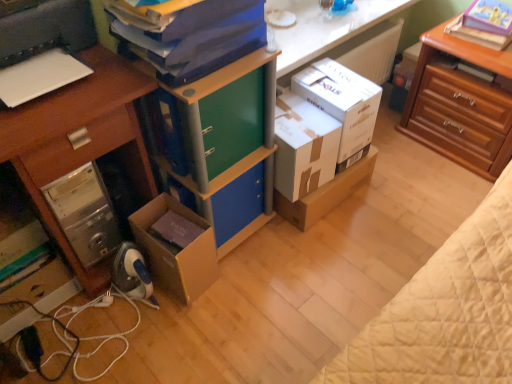
At what (x,y) coordinates should I click in order to perform the action: click on cardboard box at lower left, acting as the 1th box starting from the left. Please return your answer as a coordinate pair (x, y). Looking at the image, I should click on (179, 252).

Locate an element on the screen. The image size is (512, 384). white cardboard box at center, the 2th box from the left is located at coordinates (303, 146).

Image resolution: width=512 pixels, height=384 pixels. What do you see at coordinates (326, 194) in the screenshot?
I see `white cardboard box at center` at bounding box center [326, 194].

Measure the distance between blue matte folder at upper center and camera.

blue matte folder at upper center is 3.35 feet from camera.

Image resolution: width=512 pixels, height=384 pixels. I want to click on cardboard box at lower left, acting as the 1th box starting from the left, so click(x=179, y=252).

From a real-world perspective, which is physically below, white cardboard box at center or white plastic printer at left?

white cardboard box at center, from a real-world perspective.

Is point (366, 166) farther from viewer compared to point (54, 77)?

Yes, point (366, 166) is behind point (54, 77).

Would you say white cardboard box at center is inside or outside white plastic printer at left?

white cardboard box at center exists outside the volume of white plastic printer at left.

Based on the photo, is white cardboard box at center, the 2th box from the left, in front of or behind blue matte folder at upper center in the image?

white cardboard box at center, the 2th box from the left, is positioned farther from the viewer than blue matte folder at upper center.

From the picture: From a real-world perspective, is white cardboard box at center, the 2th box from the left, physically below blue matte folder at upper center?

Correct, in the physical world, white cardboard box at center, the 2th box from the left, is lower than blue matte folder at upper center.

Which object is positioned more to the right, white cardboard box at center, placed as the second box when sorted from right to left, or blue matte folder at upper center?

Positioned to the right is white cardboard box at center, placed as the second box when sorted from right to left.

Is white cardboard box at center, the 2th box from the left, shorter than blue matte folder at upper center?

No, white cardboard box at center, the 2th box from the left, is not shorter than blue matte folder at upper center.

Is blue matte folder at upper center inside the boundaries of white cardboard box at center, positioned as the first box in right-to-left order, or outside?

blue matte folder at upper center is not inside white cardboard box at center, positioned as the first box in right-to-left order, it's outside.

Is the position of blue matte folder at upper center more distant than that of white cardboard box at center, which is counted as the third box, starting from the left?

No, it is not.

From a real-world perspective, is blue matte folder at upper center physically above white cardboard box at center, positioned as the first box in right-to-left order?

Correct, in the physical world, blue matte folder at upper center is higher than white cardboard box at center, positioned as the first box in right-to-left order.

The width and height of the screenshot is (512, 384). Find the location of `book in front of the white cardboard box at center, positioned as the first box in right-to-left order`. book in front of the white cardboard box at center, positioned as the first box in right-to-left order is located at coordinates (200, 39).

Considering the relative positions of wooden nightstand at upper right and blue matte folder at upper center in the image provided, is wooden nightstand at upper right to the right of blue matte folder at upper center from the viewer's perspective?

Yes, wooden nightstand at upper right is to the right of blue matte folder at upper center.

Find the location of a particular element. The height and width of the screenshot is (384, 512). nightstand lying on the right of blue matte folder at upper center is located at coordinates (461, 106).

Considering the sizes of objects wooden nightstand at upper right and blue matte folder at upper center in the image provided, who is thinner, wooden nightstand at upper right or blue matte folder at upper center?

With smaller width is blue matte folder at upper center.

From a real-world perspective, is wooden nightstand at upper right physically located above or below blue matte folder at upper center?

wooden nightstand at upper right is below blue matte folder at upper center.

How different are the orientations of white cardboard box at center, positioned as the first box in right-to-left order, and wooden desk at left in degrees?

The facing directions of white cardboard box at center, positioned as the first box in right-to-left order, and wooden desk at left are 5.07 degrees apart.

From a real-world perspective, is white cardboard box at center, which is counted as the third box, starting from the left, positioned over wooden desk at left based on gravity?

No, from a real-world perspective, white cardboard box at center, which is counted as the third box, starting from the left, is not on top of wooden desk at left.

Who is shorter, white cardboard box at center, which is counted as the third box, starting from the left, or wooden desk at left?

Standing shorter between the two is white cardboard box at center, which is counted as the third box, starting from the left.

Which is more to the right, white cardboard box at center, which is counted as the third box, starting from the left, or wooden desk at left?

Result: Positioned to the right is white cardboard box at center, which is counted as the third box, starting from the left.

In the image, there is a blue matte bookshelf at center. At what (x,y) coordinates should I click in order to perform the action: click on printer above it (from the image's perspective). Please return your answer as a coordinate pair (x, y). Looking at the image, I should click on (42, 49).

Measure the distance between blue matte bookshelf at center and white plastic printer at left.

blue matte bookshelf at center is 16.36 inches from white plastic printer at left.

Between blue matte bookshelf at center and white plastic printer at left, which one has larger width?

white plastic printer at left.

Can you confirm if blue matte bookshelf at center is smaller than white plastic printer at left?

Actually, blue matte bookshelf at center might be larger than white plastic printer at left.

Between wooden desk at left and cardboard box at lower left, acting as the 1th box starting from the left, which one is positioned in front?

wooden desk at left is closer to the camera.

How many degrees apart are the facing directions of wooden desk at left and cardboard box at lower left, acting as the 1th box starting from the left?

wooden desk at left and cardboard box at lower left, acting as the 1th box starting from the left, are facing 1.84 degrees away from each other.

Starting from the wooden desk at left, which box is the 1st one behind? Please provide its 2D coordinates.

[(179, 252)]

How distant is wooden desk at left from cardboard box at lower left, acting as the 3th box starting from the right?

wooden desk at left and cardboard box at lower left, acting as the 3th box starting from the right, are 12.19 inches apart.

Locate an element on the screen. printer above the white cardboard box at center (from a real-world perspective) is located at coordinates (42, 49).

Find the location of `book in front of the white cardboard box at center, placed as the second box when sorted from right to left`. book in front of the white cardboard box at center, placed as the second box when sorted from right to left is located at coordinates (200, 39).

Estimate the real-world distances between objects in this image. Which object is further from white plastic printer at left, wooden desk at left or blue matte bookshelf at center?

blue matte bookshelf at center.

Considering their positions, is cardboard box at lower left, acting as the 1th box starting from the left, positioned closer to blue matte folder at upper center than white cardboard box at center?

The object closer to blue matte folder at upper center is cardboard box at lower left, acting as the 1th box starting from the left.

From the image, which object appears to be nearer to white glossy counter top at upper center, white cardboard box at center, placed as the second box when sorted from right to left, or wooden desk at left?

white cardboard box at center, placed as the second box when sorted from right to left, is closer to white glossy counter top at upper center.

Looking at the image, which one is located further to wooden desk at left, white plastic printer at left or white glossy counter top at upper center?

white glossy counter top at upper center is positioned further to the anchor wooden desk at left.

Looking at the image, which one is located closer to white cardboard box at center, blue matte bookshelf at center or white cardboard box at center, positioned as the first box in right-to-left order?

white cardboard box at center, positioned as the first box in right-to-left order.

From the image, which object appears to be nearer to blue matte folder at upper center, cardboard box at lower left, acting as the 1th box starting from the left, or white glossy counter top at upper center?

cardboard box at lower left, acting as the 1th box starting from the left.

Which object lies nearer to the anchor point blue matte bookshelf at center, white cardboard box at center, the 2th box from the left, or white plastic printer at left?

white cardboard box at center, the 2th box from the left, is closer to blue matte bookshelf at center.

Looking at the image, which one is located further to white cardboard box at center, which is counted as the third box, starting from the left, wooden desk at left or wooden nightstand at upper right?

The object further to white cardboard box at center, which is counted as the third box, starting from the left, is wooden desk at left.

Find the location of a particular element. The width and height of the screenshot is (512, 384). book between white plastic printer at left and wooden nightstand at upper right from left to right is located at coordinates (200, 39).

I want to click on counter top between wooden desk at left and wooden nightstand at upper right, so click(x=325, y=28).

I want to click on book between wooden desk at left and wooden nightstand at upper right, so click(x=200, y=39).

Where is `box between white cardboard box at center, which is counted as the third box, starting from the left, and white cardboard box at center vertically`? The width and height of the screenshot is (512, 384). box between white cardboard box at center, which is counted as the third box, starting from the left, and white cardboard box at center vertically is located at coordinates (303, 146).